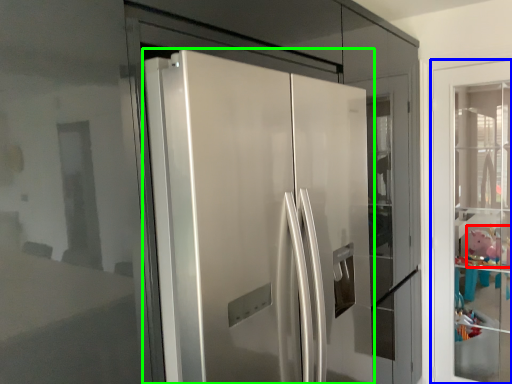
Question: Considering the real-world distances, which object is closest to toy (highlighted by a red box)? door (highlighted by a blue box) or door (highlighted by a green box).

Choices:
 (A) door
 (B) door

Answer: (A)